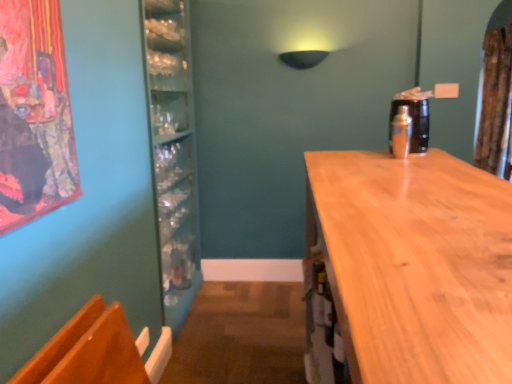
Where is `vacant space that is to the left of shiny metallic shaker at right`? The image size is (512, 384). vacant space that is to the left of shiny metallic shaker at right is located at coordinates (362, 155).